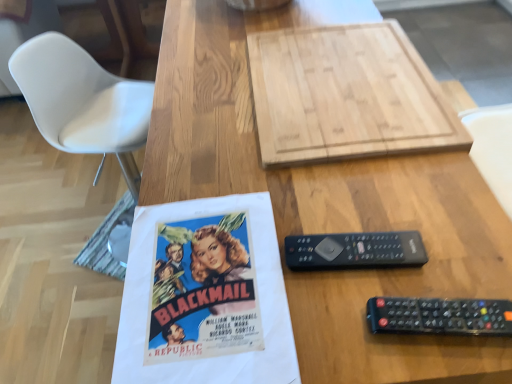
Where is `vacant space behind black plastic remote at right`? vacant space behind black plastic remote at right is located at coordinates (324, 191).